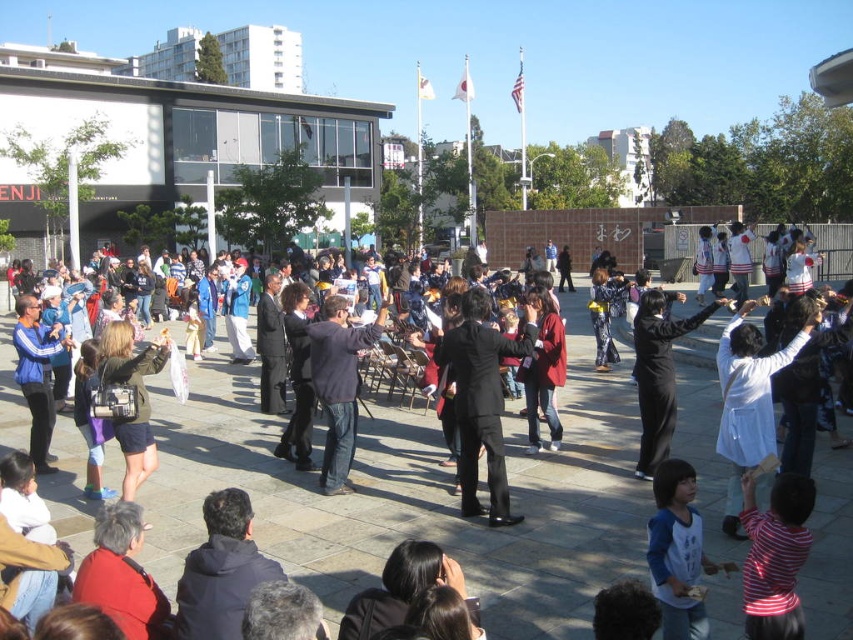
Question: Is the position of black smooth suit at center less distant than that of blue jersey at center?

Choices:
 (A) yes
 (B) no

Answer: (B)

Question: Which point is closer to the camera?

Choices:
 (A) (328, 316)
 (B) (654, 563)
 (C) (763, 579)

Answer: (C)

Question: Which point is closer to the camera?

Choices:
 (A) black matte pants at center
 (B) blue jersey at center

Answer: (B)

Question: Can you confirm if striped cotton shirt at lower right is positioned above black matte pants at center?

Choices:
 (A) yes
 (B) no

Answer: (B)

Question: Which of the following is the closest to the observer?

Choices:
 (A) (131, 451)
 (B) (477, 433)

Answer: (B)

Question: Is striped cotton shirt at lower right closer to the viewer compared to blue jersey at center?

Choices:
 (A) no
 (B) yes

Answer: (B)